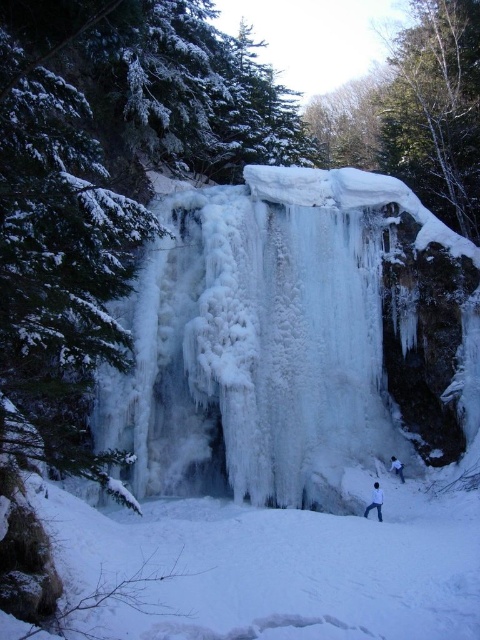
You are a photographer planning to take a photo of the white matte jacket at lower center and the gray fabric skier at lower right. Which object should be positioned closer to the camera to ensure both are in focus without adjusting the lens? Please explain your reasoning based on their sizes in the scene.

The white matte jacket at lower center is much taller than the gray fabric skier at lower right. To ensure both are in focus, the taller object should be closer to the camera because depth of field is greater when the subject is closer, allowing both sizes to be sharp without lens adjustments.

You are standing at the point marked as point (375, 500) in the winter landscape image. What object is exactly at that location?

The white matte jacket at lower center is exactly at point (375, 500).

You are standing at the base of the frozen waterfall in the winter landscape. You want to take a photo of the point at coordinates point (374, 484). Considering the camera you have can focus up to 15 meters, will you be able to capture the point clearly?

The distance of point (374, 484) from the camera is 17.20 meters, which is beyond the camera focus range of 15 meters. Therefore, you won not be able to capture the point clearly.